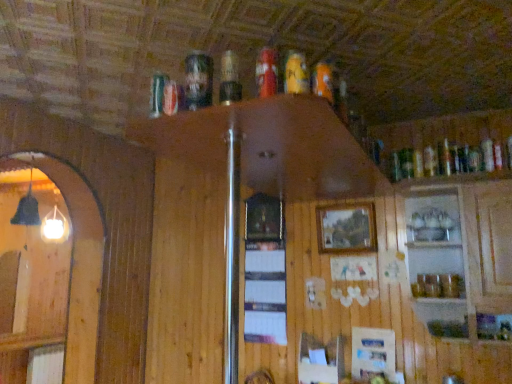
Question: Based on their positions, is orange matte can at upper center, the 1th beer from the right, located to the left or right of matte plastic beer at upper center, arranged as the 3th beer when viewed from the left?

Choices:
 (A) left
 (B) right

Answer: (B)

Question: Which is correct: orange matte can at upper center, which appears as the fourth beer when viewed from the left, is inside matte plastic beer at upper center, arranged as the 3th beer when viewed from the left, or outside of it?

Choices:
 (A) outside
 (B) inside

Answer: (A)

Question: Which is farther from the matte plastic beer can at upper center, which ranks as the 3th beer in right-to-left order?

Choices:
 (A) matte plastic beer at upper center, arranged as the 3th beer when viewed from the left
 (B) clear glass cabinet at upper right
 (C) orange matte can at upper center, which appears as the fourth beer when viewed from the left
 (D) shiny silver can at upper center, which is counted as the 1th beer, starting from the left
 (E) wooden picture frame at center

Answer: (B)

Question: Which is farther from the clear glass cabinet at upper right?

Choices:
 (A) wooden picture frame at center
 (B) matte plastic beer can at upper center, placed as the 2th beer when sorted from left to right
 (C) shiny silver can at upper center, which is counted as the 1th beer, starting from the left
 (D) matte plastic beer at upper center, which is the second beer in right-to-left order
 (E) orange matte can at upper center, the 1th beer from the right

Answer: (C)